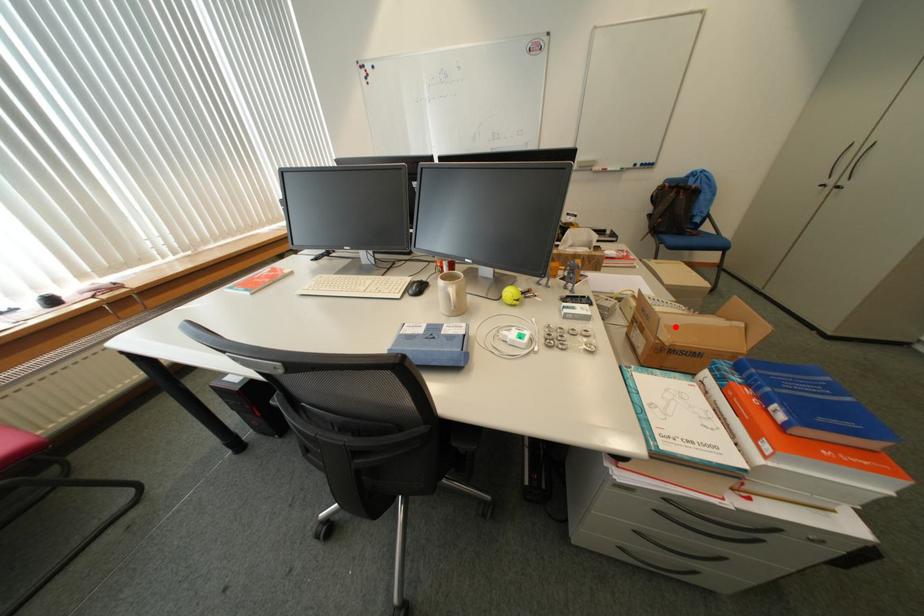
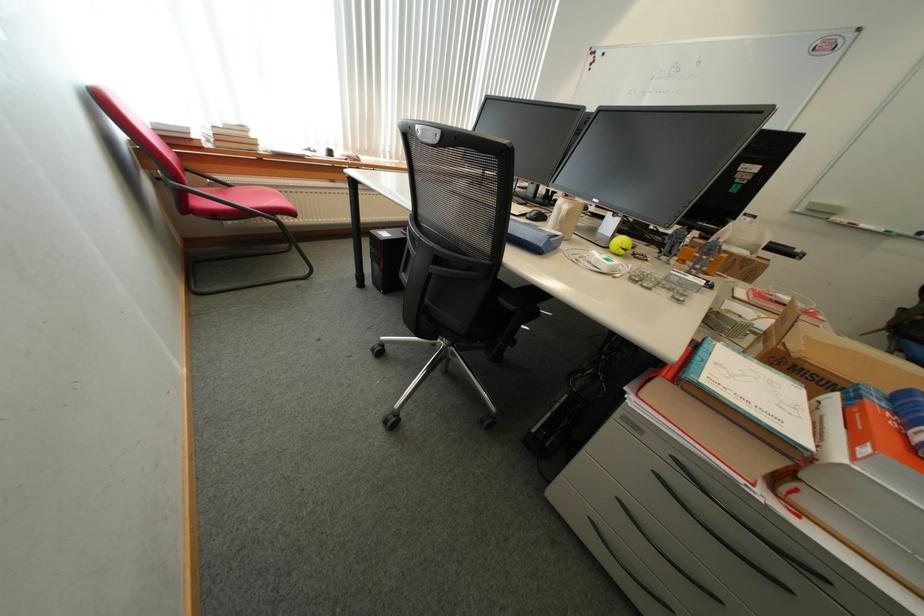
The point at the highlighted location is marked in the first image. Where is the corresponding point in the second image?

(816, 339)